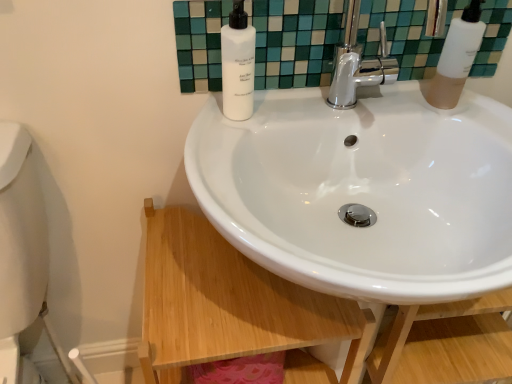
Where is `free location in front of white matte bottle at upper right, acting as the first soap dispenser starting from the right`? free location in front of white matte bottle at upper right, acting as the first soap dispenser starting from the right is located at coordinates (470, 124).